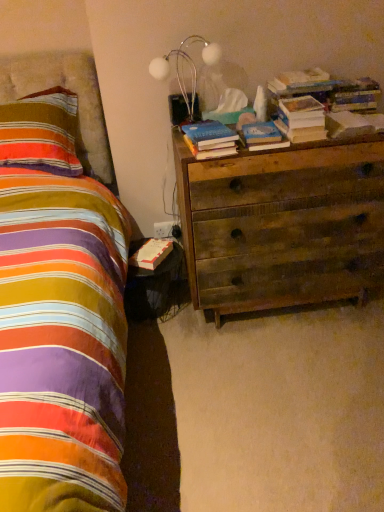
Question: From the image's perspective, is hardcover book at upper right, placed as the 3th paperback book when sorted from bottom to top, on top of hardcover book at center, acting as the second paperback book starting from the bottom?

Choices:
 (A) yes
 (B) no

Answer: (A)

Question: Considering the relative sizes of hardcover book at upper right, which ranks as the second paperback book in back-to-front order, and hardcover book at center, arranged as the 2th paperback book when viewed from the right, in the image provided, is hardcover book at upper right, which ranks as the second paperback book in back-to-front order, bigger than hardcover book at center, arranged as the 2th paperback book when viewed from the right,?

Choices:
 (A) yes
 (B) no

Answer: (A)

Question: Is hardcover book at upper right, placed as the 3th paperback book when sorted from bottom to top, facing away from hardcover book at center, which is the 1th paperback book in front-to-back order?

Choices:
 (A) yes
 (B) no

Answer: (B)

Question: Would you consider hardcover book at upper right, arranged as the 1th paperback book when viewed from the top, to be distant from hardcover book at center, which is the 2th paperback book in left-to-right order?

Choices:
 (A) yes
 (B) no

Answer: (B)

Question: Is hardcover book at upper right, the first paperback book from the right, with hardcover book at center, arranged as the 2th paperback book when viewed from the right?

Choices:
 (A) no
 (B) yes

Answer: (A)

Question: Is hardcover book at upper right, which ranks as the first book in right-to-left order, situated inside hardcover book at center, marked as the 2th book in a right-to-left arrangement, or outside?

Choices:
 (A) inside
 (B) outside

Answer: (B)

Question: Is hardcover book at upper right, which ranks as the first book in right-to-left order, taller or shorter than hardcover book at center, which is the 1th book in left-to-right order?

Choices:
 (A) tall
 (B) short

Answer: (A)

Question: From the image's perspective, is hardcover book at upper right, which ranks as the first book in right-to-left order, above or below hardcover book at center, marked as the 2th book in a right-to-left arrangement?

Choices:
 (A) above
 (B) below

Answer: (A)

Question: Considering the positions of point [x=296, y=134] and point [x=236, y=148], is point [x=296, y=134] closer or farther from the camera than point [x=236, y=148]?

Choices:
 (A) farther
 (B) closer

Answer: (A)

Question: From the image's perspective, is hardcover book at bedside, the third paperback book positioned from the front, located above or below hardcover book at center, which is the third paperback book from back to front?

Choices:
 (A) below
 (B) above

Answer: (A)

Question: Is point (134, 259) positioned closer to the camera than point (251, 130)?

Choices:
 (A) farther
 (B) closer

Answer: (A)

Question: From a real-world perspective, relative to hardcover book at center, arranged as the 2th paperback book when viewed from the right, is hardcover book at bedside, arranged as the 3th paperback book when viewed from the right, vertically above or below?

Choices:
 (A) below
 (B) above

Answer: (A)

Question: Is hardcover book at bedside, the 3th paperback book positioned from the top, taller or shorter than hardcover book at center, which is the second paperback book from top to bottom?

Choices:
 (A) short
 (B) tall

Answer: (B)

Question: Looking at their shapes, would you say striped fabric pillow at left is wider or thinner than hardcover book at upper right, which ranks as the first book in right-to-left order?

Choices:
 (A) wide
 (B) thin

Answer: (A)

Question: From the image's perspective, is striped fabric pillow at left positioned above or below hardcover book at upper right, which ranks as the first book in right-to-left order?

Choices:
 (A) below
 (B) above

Answer: (B)